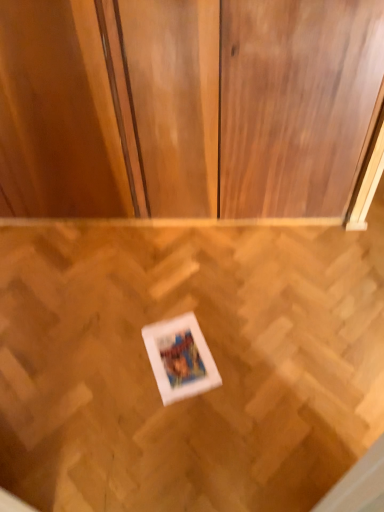
You are a GUI agent. You are given a task and a screenshot of the screen. Output one action in this format:
    pyautogui.click(x=<x>, y=<y>)
    Task: Click on the vacant space in between matte wood dresser at center and white matte picture frame at center
    This screenshot has width=384, height=512.
    Given the screenshot: What is the action you would take?
    pyautogui.click(x=171, y=270)